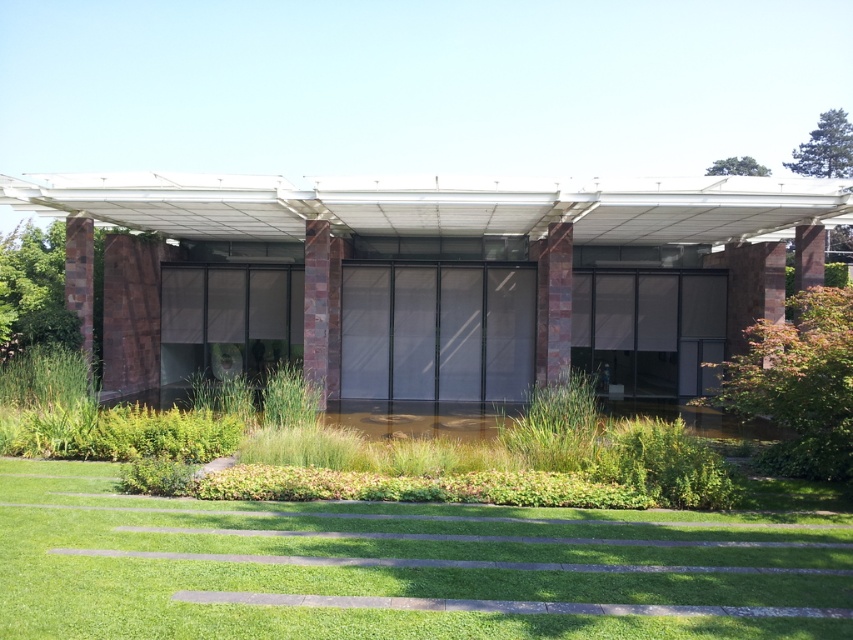
You are standing at the entrance of the building and want to reach the point marked by point (422, 220). However, there is an obstacle at point (546, 604). Can you walk directly to your destination without going around the obstacle?

Since point (422, 220) is behind point (546, 604), you cannot walk directly to your destination without going around the obstacle at point (546, 604).

You are planning to place a large potted plant in the garden area. The potted plant requires a sunny spot that is not under any structure. Based on the scene, can you confirm if the green grass at lower center is exposed to direct sunlight or shaded by the matte white pergola at center?

The matte white pergola at center is positioned over green grass at lower center, so the green grass at lower center is shaded by the matte white pergola at center, making it unsuitable for a potted plant requiring direct sunlight.

You are a landscape designer planning to install a new lighting system. You need to determine if the matte white pergola at center can be illuminated without obstructing the view of the green grass at lower center. Can the lights be placed in a way that allows both to be visible?

The matte white pergola at center is taller than the green grass at lower center. Therefore, lights can be placed above the pergola to illuminate it while still allowing the shorter green grass at lower center to remain visible below.